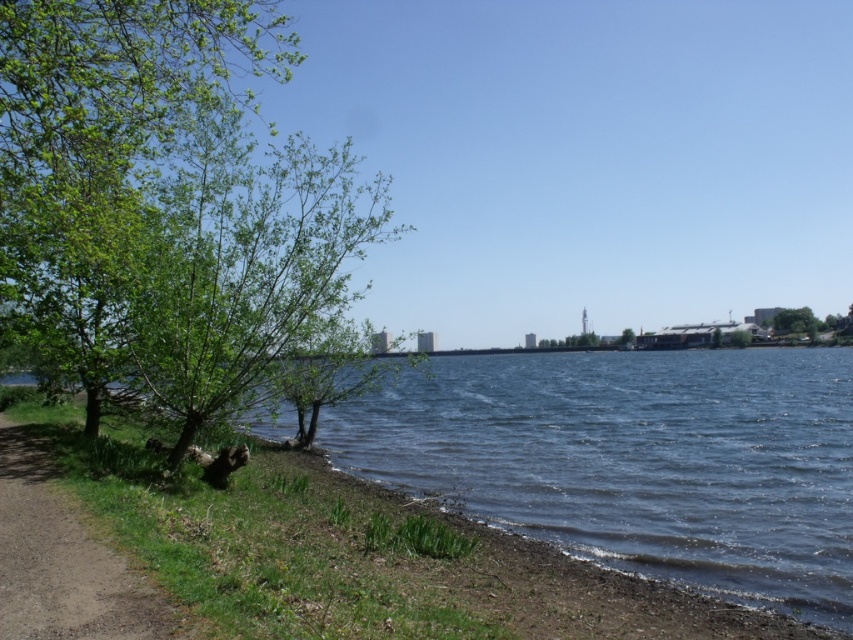
What is the 2D coordinate of the green leafy tree at left in the image?

The green leafy tree at left is located at the 2D coordinate point of (161, 198).

You are standing on the grassy area in the foreground of the lakeside scene. You notice two green leafy trees. Which tree, the green leafy tree at left or the green leafy tree at center, is positioned higher up in the image?

The green leafy tree at left is positioned higher up in the image than the green leafy tree at center.

You are standing in the middle of the grassy area and want to walk to the green leafy tree at upper right. Which direction should you head towards, away from the green leafy tree at left?

You should move away from the green leafy tree at left and head towards the upper right direction to reach the green leafy tree at upper right since it is further away from you compared to the tree at left.